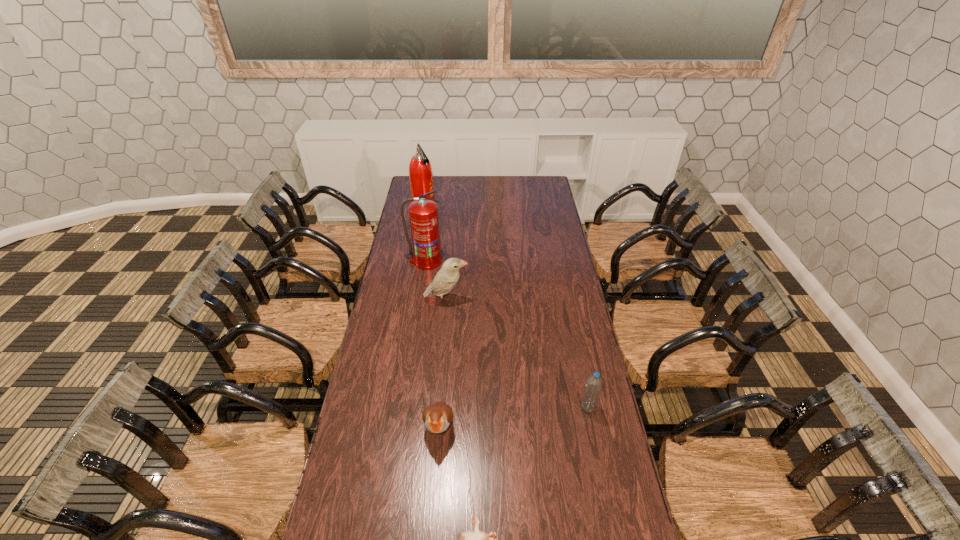
Locate an element on the screen. unoccupied area between the fifth nearest object and the rightmost object is located at coordinates (507, 334).

The height and width of the screenshot is (540, 960). I want to click on empty location between the second nearest bird and the farthest object, so click(432, 320).

In order to click on free space that is in between the nearer fire extinguisher and the third shortest object in this screenshot , I will do `click(507, 334)`.

Select which object appears as the fifth closest to the second farthest object. Please provide its 2D coordinates. Your answer should be formatted as a tuple, i.e. [(x, y)], where the tuple contains the x and y coordinates of a point satisfying the conditions above.

[(475, 539)]

Find the location of `object that can be found as the fourth closest to the tallest bird`. object that can be found as the fourth closest to the tallest bird is located at coordinates (592, 390).

Identify the location of bird that stands as the second closest to the rightmost object. (475, 539).

Point out which bird is positioned as the second nearest to the farthest object. Please provide its 2D coordinates. Your answer should be formatted as a tuple, i.e. [(x, y)], where the tuple contains the x and y coordinates of a point satisfying the conditions above.

[(437, 417)]

Image resolution: width=960 pixels, height=540 pixels. In order to click on blank space that satisfies the following two spatial constraints: 1. on the instruction side of the third shortest object; 2. on the right side of the nearer fire extinguisher in this screenshot , I will do `click(404, 407)`.